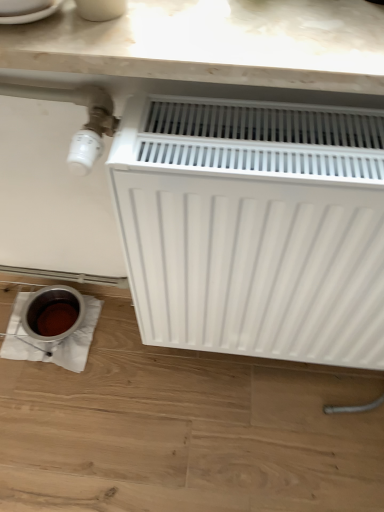
Question: From the image's perspective, is white matte radiator at center above or below white marble countertop at upper center?

Choices:
 (A) above
 (B) below

Answer: (B)

Question: From a real-world perspective, is white matte radiator at center above or below white marble countertop at upper center?

Choices:
 (A) above
 (B) below

Answer: (B)

Question: Which is correct: white matte radiator at center is inside white marble countertop at upper center, or outside of it?

Choices:
 (A) outside
 (B) inside

Answer: (A)

Question: In the image, is white marble countertop at upper center positioned in front of or behind white matte radiator at center?

Choices:
 (A) behind
 (B) front

Answer: (A)

Question: From a real-world perspective, is white marble countertop at upper center physically located above or below white matte radiator at center?

Choices:
 (A) above
 (B) below

Answer: (A)

Question: In terms of height, does white marble countertop at upper center look taller or shorter compared to white matte radiator at center?

Choices:
 (A) tall
 (B) short

Answer: (B)

Question: From the image's perspective, is white marble countertop at upper center located above or below white matte radiator at center?

Choices:
 (A) above
 (B) below

Answer: (A)